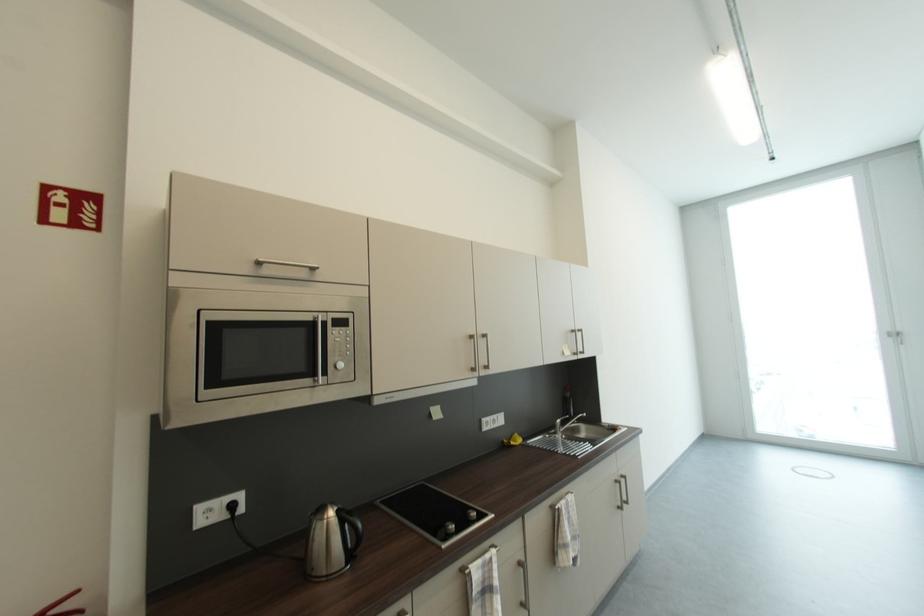
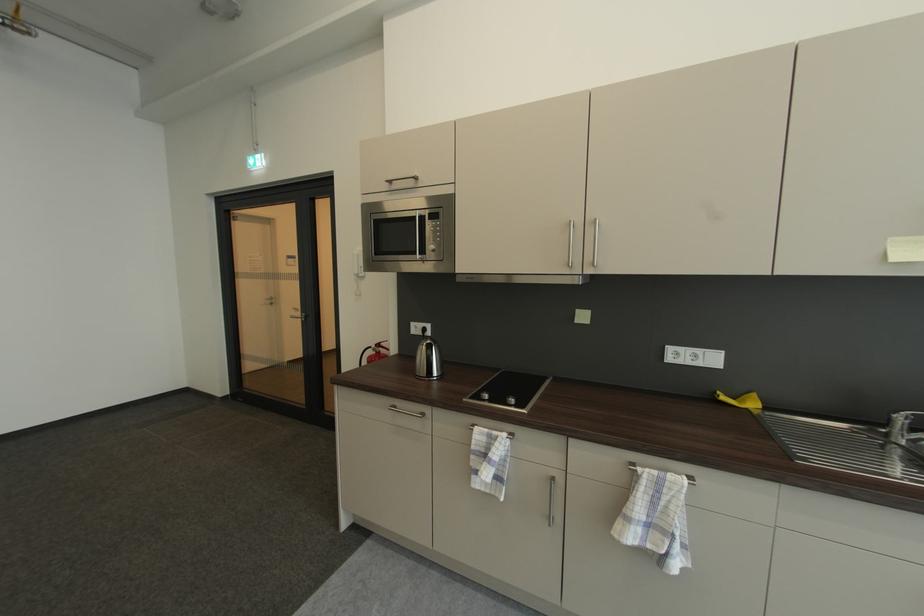
The point at (560, 434) is marked in the first image. Where is the corresponding point in the second image?

(892, 432)